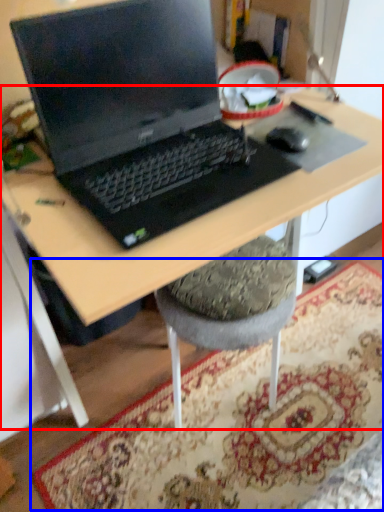
Question: Which object appears closest to the camera in this image, desk (highlighted by a red box) or mat (highlighted by a blue box)?

Choices:
 (A) desk
 (B) mat

Answer: (A)